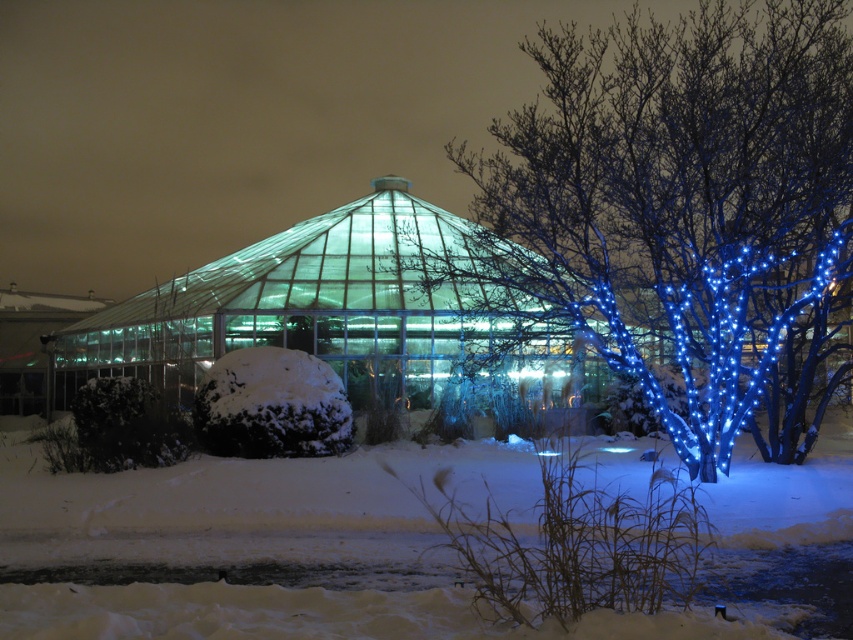
Does blue led-lit branches at center appear on the left side of white fluffy snow at lower center?

Incorrect, blue led-lit branches at center is not on the left side of white fluffy snow at lower center.

Who is taller, blue led-lit branches at center or white fluffy snow at lower center?

With more height is blue led-lit branches at center.

At what (x,y) coordinates should I click in order to perform the action: click on blue led-lit branches at center. Please return your answer as a coordinate pair (x, y). Looking at the image, I should click on (682, 212).

Image resolution: width=853 pixels, height=640 pixels. Identify the location of blue led-lit branches at center. (682, 212).